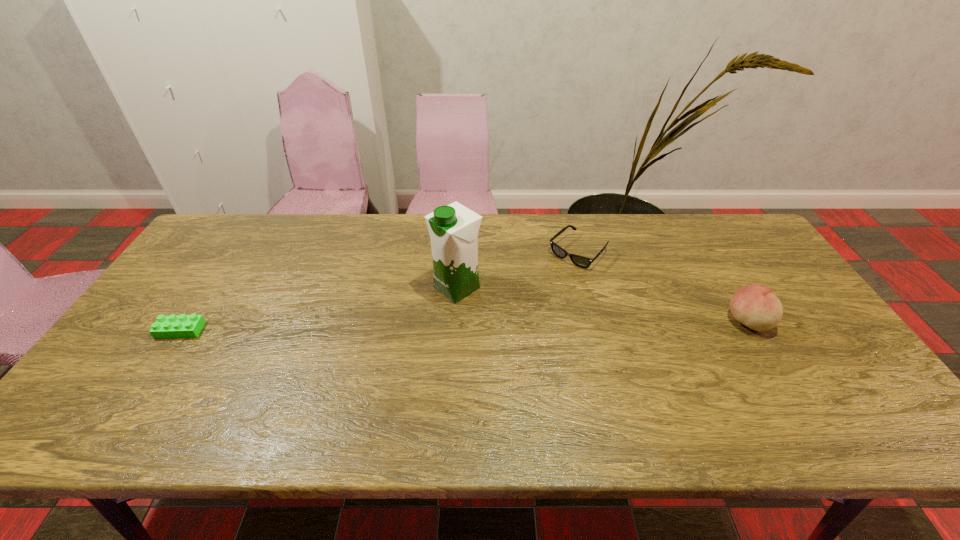
I want to click on blank area located on the front-facing side of the sunglasses, so click(x=548, y=281).

Where is `vacant region located 0.150m on the front-facing side of the sunglasses`? The height and width of the screenshot is (540, 960). vacant region located 0.150m on the front-facing side of the sunglasses is located at coordinates (535, 293).

This screenshot has height=540, width=960. I want to click on blank space located on the front-facing side of the sunglasses, so click(508, 319).

Find the location of a particular element. The width and height of the screenshot is (960, 540). vacant space positioned 0.160m on the front-facing side of the soya milk is located at coordinates (391, 329).

Where is `free location located 0.370m on the front-facing side of the soya milk`? The height and width of the screenshot is (540, 960). free location located 0.370m on the front-facing side of the soya milk is located at coordinates (319, 374).

Locate an element on the screen. Image resolution: width=960 pixels, height=540 pixels. blank space located on the front-facing side of the soya milk is located at coordinates (x=406, y=319).

This screenshot has width=960, height=540. Identify the location of object that is at the far edge. (580, 261).

I want to click on object that is at the left edge, so click(x=173, y=326).

Where is `object at the right edge`? The image size is (960, 540). object at the right edge is located at coordinates (x=756, y=306).

I want to click on vacant space at the far edge of the desktop, so [x=394, y=250].